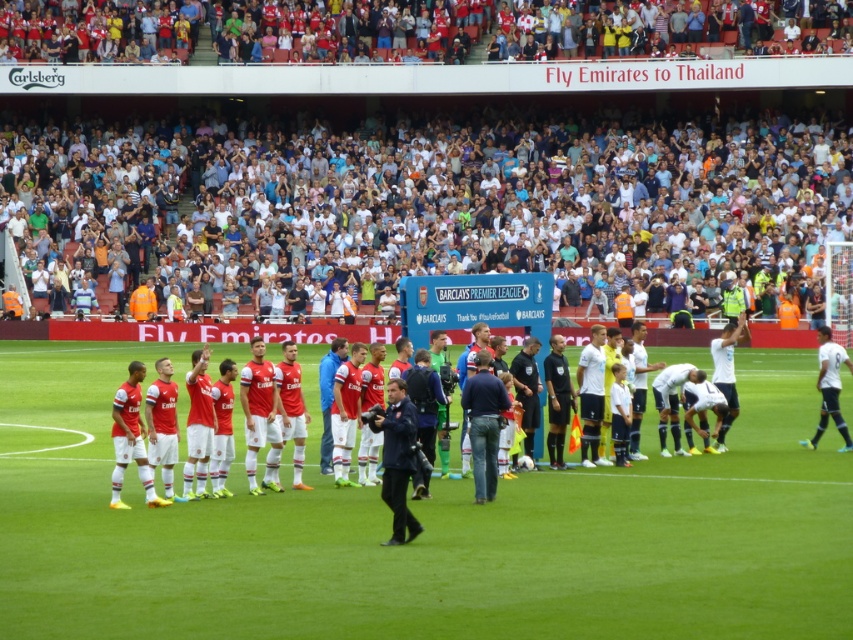
Looking at this image, you are a referee standing at the center of the field. You need to decide which of the two points, point (x=397, y=609) or point (x=660, y=340), is closer to the front of the field. Based on the coordinates provided, which point is closer to the front?

Point (x=397, y=609) is in front of point (x=660, y=340), so it is closer to the front of the field.

You are a photographer standing at the center of the stadium field. You want to take a photo of the point at coordinates point [146,326]. If your camera has a maximum focus range of 50 meters, will you be able to focus on that point?

The distance of point [146,326] from the camera is 47.68 meters, which is within the camera maximum focus range of 50 meters. Therefore, the camera can focus on that point.

You are a drone operator tasked with capturing aerial footage of the football match. Your drone is currently hovering above the white synthetic turf at center. To ensure safety, you need to move it at least 6 meters away from the red matte soccer team at center. Is your current position compliant with the safety requirement?

The white synthetic turf at center is 5.41 meters away from the red matte soccer team at center. Since 5.41 meters is less than the required 6 meters, the drone is not compliant with the safety requirement and needs to move further away.